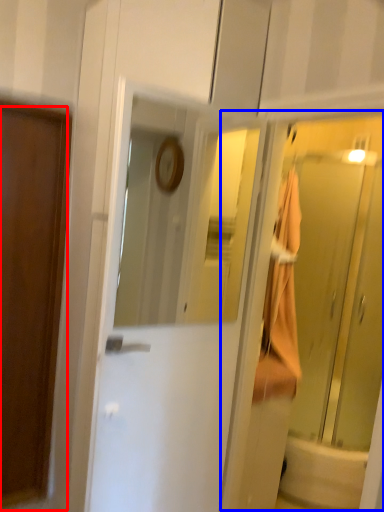
Question: Among these objects, which one is nearest to the camera, door (highlighted by a red box) or elevator (highlighted by a blue box)?

Choices:
 (A) door
 (B) elevator

Answer: (A)